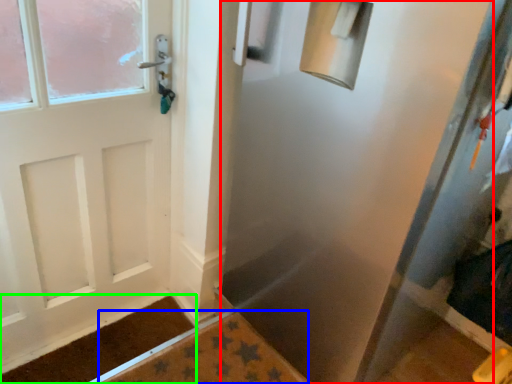
Question: Which object is the closest to the screen door (highlighted by a red box)? Choose among these: bath mat (highlighted by a blue box) or doormat (highlighted by a green box).

Choices:
 (A) bath mat
 (B) doormat

Answer: (A)